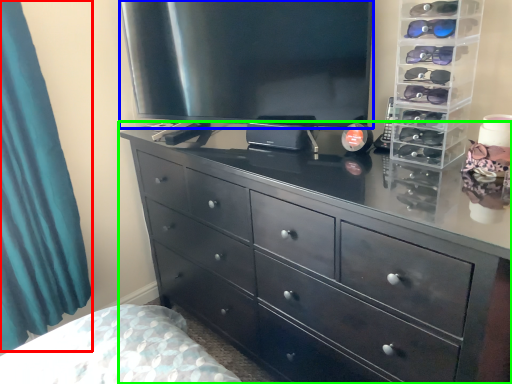
Question: Which object is positioned farthest from curtain (highlighted by a red box)? Select from television (highlighted by a blue box) and chest of drawers (highlighted by a green box).

Choices:
 (A) television
 (B) chest of drawers

Answer: (B)